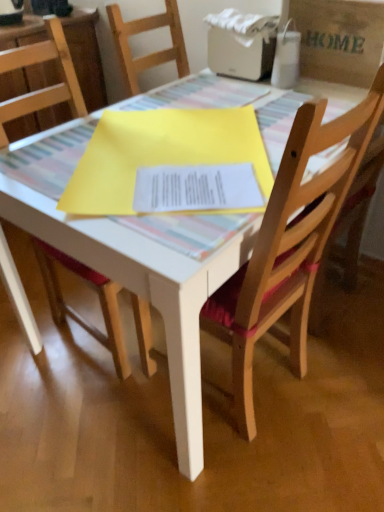
Locate an element on the screen. This screenshot has height=512, width=384. free space in front of white plastic printer at upper center is located at coordinates (236, 92).